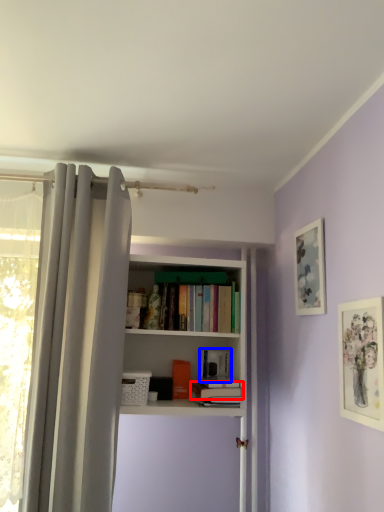
Question: Which point is closer to the camera, book (highlighted by a red box) or book (highlighted by a blue box)?

Choices:
 (A) book
 (B) book

Answer: (A)